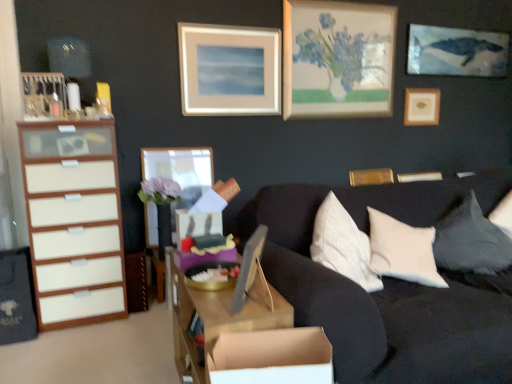
Locate an element on the screen. The height and width of the screenshot is (384, 512). vacant space situated on the left part of wooden picture frame at center, the 1th picture frame from the front is located at coordinates (214, 307).